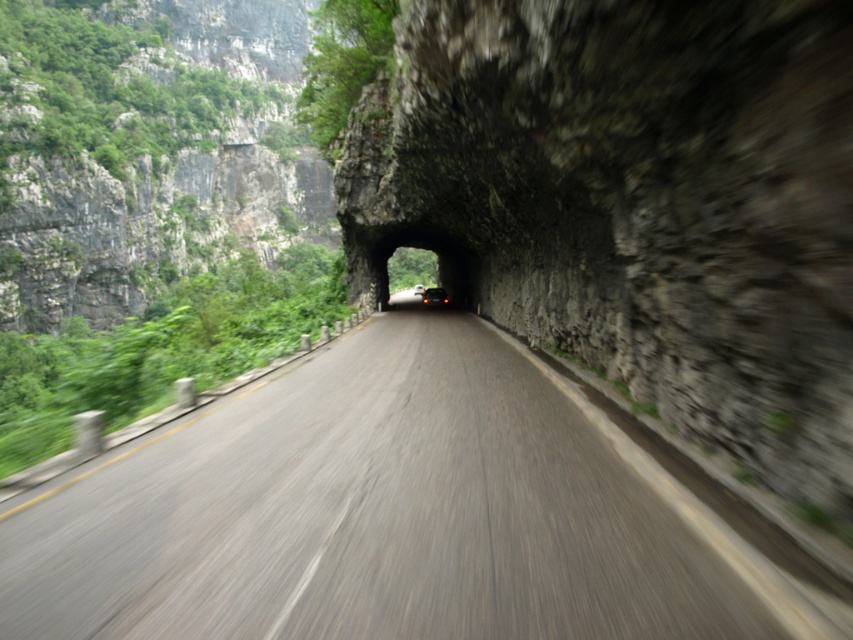
Does point (357, 538) come in front of point (26, 144)?

Yes, it is in front of point (26, 144).

Is smooth asphalt road at center below green rough rock at left?

Yes, smooth asphalt road at center is below green rough rock at left.

Locate an element on the screen. This screenshot has height=640, width=853. smooth asphalt road at center is located at coordinates (395, 515).

Who is more distant from viewer, (13,289) or (422,289)?

The point (422,289) is behind.

Is green rough rock at left further to the viewer compared to matte black car at center?

Yes, green rough rock at left is behind matte black car at center.

Image resolution: width=853 pixels, height=640 pixels. What do you see at coordinates (154, 161) in the screenshot? I see `green rough rock at left` at bounding box center [154, 161].

Find the location of a particular element. This screenshot has height=640, width=853. green rough rock at left is located at coordinates (154, 161).

Is point (256, 16) in front of point (416, 284)?

No, it is behind (416, 284).

Is green rough rock at left to the right of shiny black car at center from the viewer's perspective?

Incorrect, green rough rock at left is not on the right side of shiny black car at center.

Who is more forward, (x=235, y=120) or (x=419, y=285)?

Point (x=419, y=285) is in front.

At what (x,y) coordinates should I click in order to perform the action: click on green rough rock at left. Please return your answer as a coordinate pair (x, y). The image size is (853, 640). Looking at the image, I should click on (154, 161).